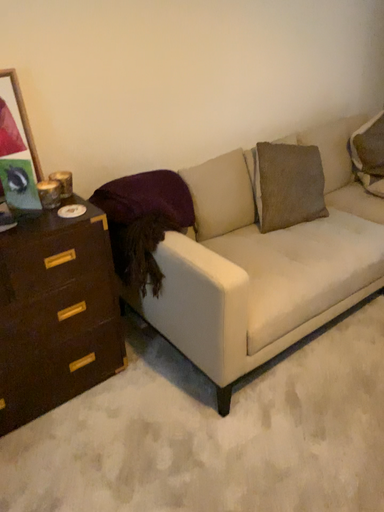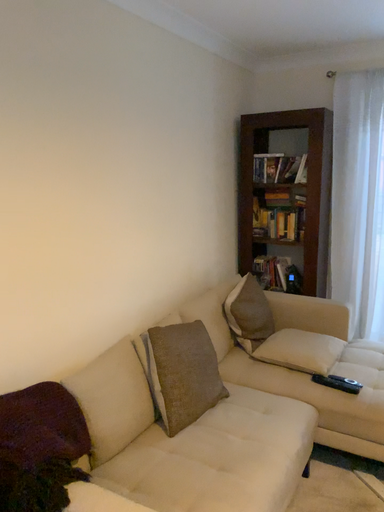
Question: How did the camera likely rotate when shooting the video?

Choices:
 (A) rotated downward
 (B) rotated upward

Answer: (B)